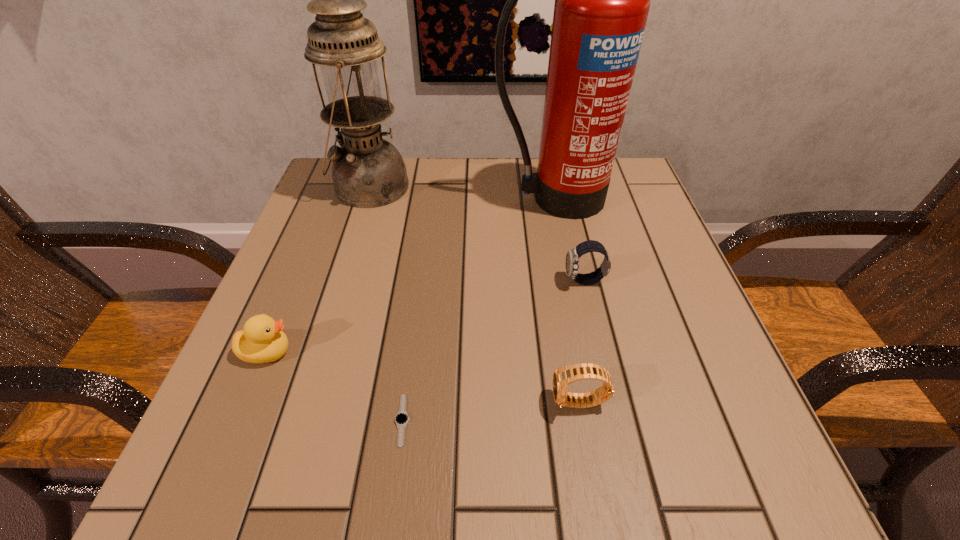
Identify the location of free spot that satisfies the following two spatial constraints: 1. on the surface of the fire extinguisher; 2. on the face of the duckling. (585, 352).